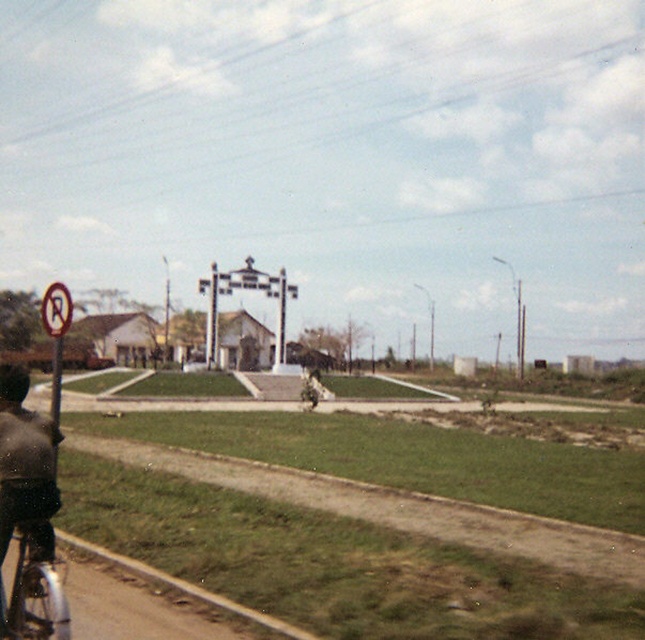
You are standing at the center of the plaza and want to locate the silver metallic bicycle at lower left. According to the 2D coordinates, in which direction should you look to find it?

The silver metallic bicycle at lower left is located at coordinates point (32, 566), so you should look to the lower left direction to find it.

You are a pedestrian standing at the edge of the road and see the silver metallic bicycle at lower left and the white plastic no parking sign at left. Which object is closer to the center of the road?

The silver metallic bicycle at lower left is closer to the center of the road because it is positioned to the right of the white plastic no parking sign at left, meaning it is farther from the left edge and thus nearer to the road center.